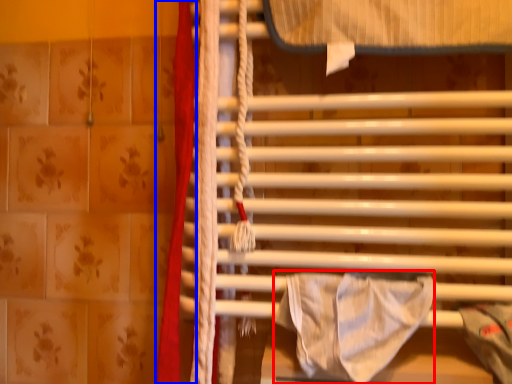
Question: Which point is further to the camera, blanket (highlighted by a red box) or curtain (highlighted by a blue box)?

Choices:
 (A) blanket
 (B) curtain

Answer: (B)